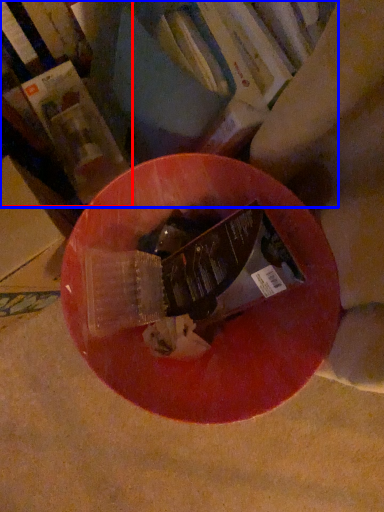
Question: Which object appears farthest to the camera in this image, book (highlighted by a red box) or book (highlighted by a blue box)?

Choices:
 (A) book
 (B) book

Answer: (A)